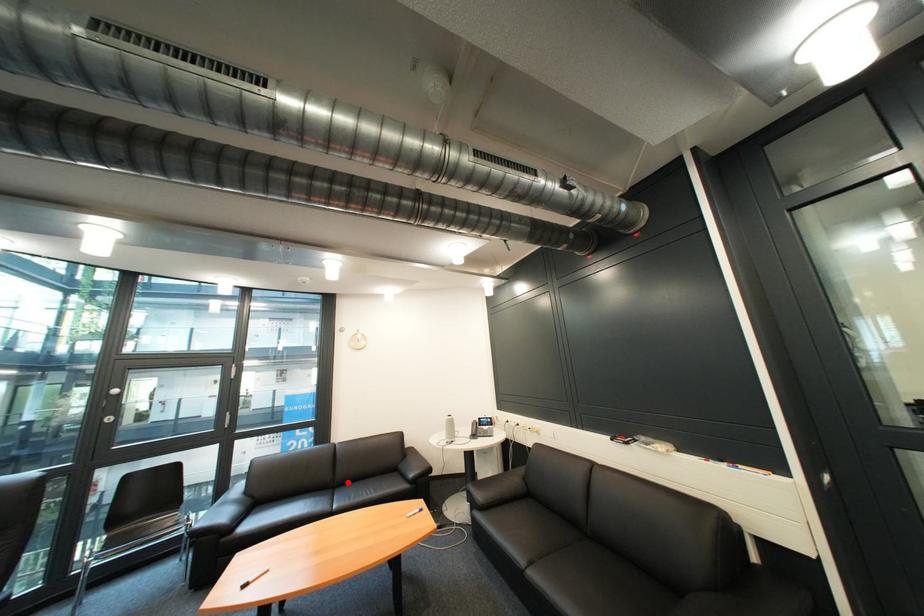
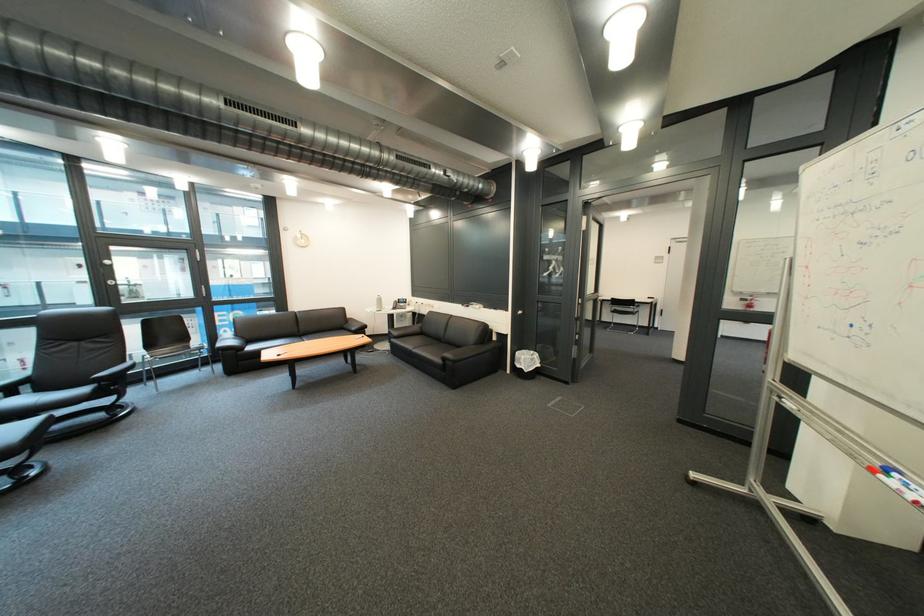
The point at the highlighted location is marked in the first image. Where is the corresponding point in the second image?

(312, 334)